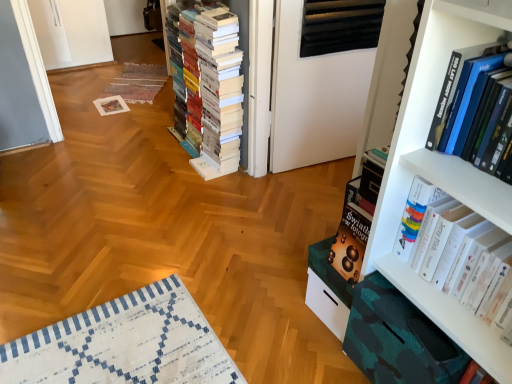
Question: From the image's perspective, is white glossy book at right, which is the second book in front-to-back order, above white matte book at center, the 3th book in the right-to-left sequence?

Choices:
 (A) yes
 (B) no

Answer: (B)

Question: Is white glossy book at right, which ranks as the 1th book in right-to-left order, bigger than white matte book at center, which appears as the third book when viewed from the front?

Choices:
 (A) no
 (B) yes

Answer: (A)

Question: Can you confirm if white glossy book at right, which is the second book in front-to-back order, is positioned to the right of white matte book at center, the first book viewed from the back?

Choices:
 (A) no
 (B) yes

Answer: (B)

Question: Is white glossy book at right, the second book when ordered from back to front, wider than white matte book at center, which appears as the third book when viewed from the front?

Choices:
 (A) yes
 (B) no

Answer: (B)

Question: From the image's perspective, would you say white glossy book at right, the second book when ordered from back to front, is shown under white matte book at center, which appears as the third book when viewed from the front?

Choices:
 (A) no
 (B) yes

Answer: (B)

Question: Does point (444, 140) appear closer or farther from the camera than point (242, 109)?

Choices:
 (A) closer
 (B) farther

Answer: (A)

Question: In the image, is hardcover book at upper right, the second book in the right-to-left sequence, positioned in front of or behind white matte book at center, acting as the first book starting from the left?

Choices:
 (A) behind
 (B) front

Answer: (B)

Question: From the image's perspective, is hardcover book at upper right, the 2th book positioned from the left, located above or below white matte book at center, acting as the first book starting from the left?

Choices:
 (A) below
 (B) above

Answer: (A)

Question: Looking at the image, does hardcover book at upper right, the third book in the back-to-front sequence, seem bigger or smaller compared to white matte book at center, the first book viewed from the back?

Choices:
 (A) big
 (B) small

Answer: (B)

Question: Choose the correct answer: Is white matte book at center, the first book viewed from the back, inside white matte bookcase at right or outside it?

Choices:
 (A) inside
 (B) outside

Answer: (B)

Question: Does point (240, 51) appear closer or farther from the camera than point (494, 200)?

Choices:
 (A) closer
 (B) farther

Answer: (B)

Question: Is white matte book at center, the 3th book in the right-to-left sequence, in front of or behind white matte bookcase at right in the image?

Choices:
 (A) front
 (B) behind

Answer: (B)

Question: Looking at the image, does white matte book at center, acting as the first book starting from the left, seem bigger or smaller compared to white matte bookcase at right?

Choices:
 (A) big
 (B) small

Answer: (A)

Question: Looking at their shapes, would you say white glossy book at right, the second book when ordered from back to front, is wider or thinner than white matte book at center, the first book viewed from the back?

Choices:
 (A) wide
 (B) thin

Answer: (B)

Question: From a real-world perspective, is white glossy book at right, which ranks as the 1th book in right-to-left order, physically located above or below white matte book at center, acting as the first book starting from the left?

Choices:
 (A) above
 (B) below

Answer: (A)